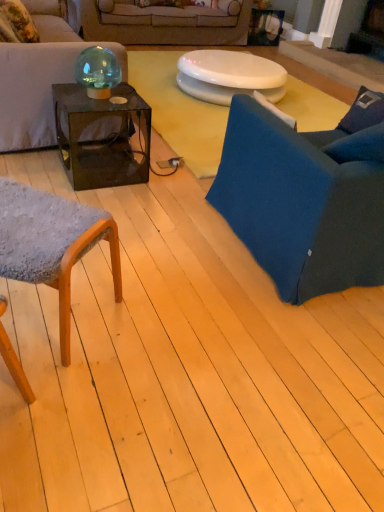
Question: Considering the relative sizes of transparent glass cube at center and textured gray fabric chair at lower left, which is the second chair in right-to-left order, in the image provided, is transparent glass cube at center shorter than textured gray fabric chair at lower left, which is the second chair in right-to-left order,?

Choices:
 (A) no
 (B) yes

Answer: (B)

Question: Can we say transparent glass cube at center lies outside textured gray fabric chair at lower left, which is the second chair in right-to-left order?

Choices:
 (A) yes
 (B) no

Answer: (A)

Question: Can you confirm if transparent glass cube at center is positioned to the right of textured gray fabric chair at lower left, which is the 1th chair from left to right?

Choices:
 (A) yes
 (B) no

Answer: (A)

Question: Is transparent glass cube at center taller than textured gray fabric chair at lower left, which is the 1th chair from left to right?

Choices:
 (A) no
 (B) yes

Answer: (A)

Question: From a real-world perspective, is transparent glass cube at center on textured gray fabric chair at lower left, which is the 1th chair from left to right?

Choices:
 (A) yes
 (B) no

Answer: (B)

Question: Is transparent glass cube at center far away from textured gray fabric chair at lower left, which is the second chair in right-to-left order?

Choices:
 (A) no
 (B) yes

Answer: (B)

Question: Is blue fabric chair at right, the first chair positioned from the right, positioned in front of beige fabric couch at upper center, positioned as the 2th studio couch in front-to-back order?

Choices:
 (A) yes
 (B) no

Answer: (A)

Question: Are blue fabric chair at right, the first chair positioned from the right, and beige fabric couch at upper center, arranged as the first studio couch when viewed from the back, located far from each other?

Choices:
 (A) yes
 (B) no

Answer: (A)

Question: Considering the relative positions of blue fabric chair at right, the first chair positioned from the right, and beige fabric couch at upper center, positioned as the 2th studio couch in front-to-back order, in the image provided, is blue fabric chair at right, the first chair positioned from the right, behind beige fabric couch at upper center, positioned as the 2th studio couch in front-to-back order,?

Choices:
 (A) yes
 (B) no

Answer: (B)

Question: From a real-world perspective, is blue fabric chair at right, the first chair positioned from the right, physically below beige fabric couch at upper center, positioned as the 2th studio couch in front-to-back order?

Choices:
 (A) no
 (B) yes

Answer: (A)

Question: Can you confirm if blue fabric chair at right, the first chair positioned from the right, is wider than beige fabric couch at upper center, arranged as the first studio couch when viewed from the back?

Choices:
 (A) no
 (B) yes

Answer: (A)

Question: Does blue fabric chair at right, which is the second chair from left to right, have a larger size compared to beige fabric couch at upper center, positioned as the 2th studio couch in front-to-back order?

Choices:
 (A) yes
 (B) no

Answer: (B)

Question: Is matte black couch at upper left, placed as the first studio couch when sorted from front to back, taller than white glossy toilet seat at center?

Choices:
 (A) yes
 (B) no

Answer: (A)